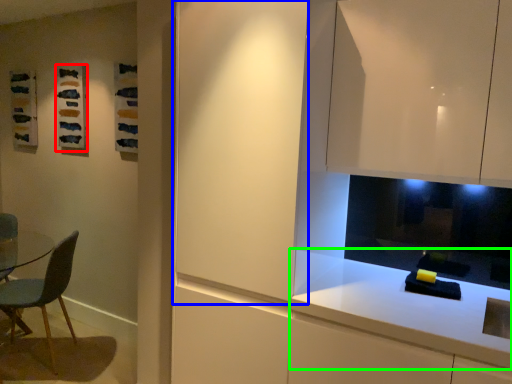
Question: Which is nearer to the art (highlighted by a red box)? glass door (highlighted by a blue box) or countertop (highlighted by a green box).

Choices:
 (A) glass door
 (B) countertop

Answer: (A)